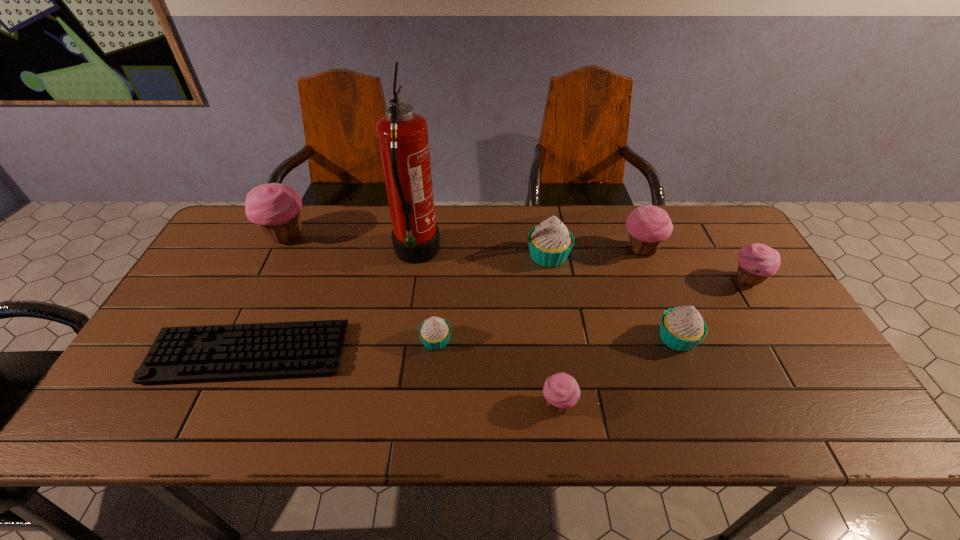
In the image, there is a desktop. At what (x,y) coordinates should I click in order to perform the action: click on vacant space at the far edge. Please return your answer as a coordinate pair (x, y). Image resolution: width=960 pixels, height=540 pixels. Looking at the image, I should click on (528, 210).

I want to click on free space at the near edge of the desktop, so click(x=418, y=430).

You are a GUI agent. You are given a task and a screenshot of the screen. Output one action in this format:
    pyautogui.click(x=<x>, y=<y>)
    Task: Click on the vacant space at the left edge of the desktop
    
    Given the screenshot: What is the action you would take?
    pyautogui.click(x=237, y=265)

Locate an element on the screen. Image resolution: width=960 pixels, height=540 pixels. vacant space at the right edge of the desktop is located at coordinates (779, 311).

Identify the location of vacant space at the far right corner. Image resolution: width=960 pixels, height=540 pixels. (694, 207).

Find the location of a particular element. This screenshot has width=960, height=540. empty space that is in between the leftmost cupcake and the fire extinguisher is located at coordinates (351, 245).

At what (x,y) coordinates should I click in order to perform the action: click on free space between the rightmost white cupcake and the second cupcake from left to right. Please return your answer as a coordinate pair (x, y). Looking at the image, I should click on (557, 339).

At what (x,y) coordinates should I click in order to perform the action: click on free space between the nearest object and the third smallest pink cupcake. Please return your answer as a coordinate pair (x, y). Looking at the image, I should click on (599, 327).

Where is `vacant space in between the rightmost object and the farthest white cupcake`? vacant space in between the rightmost object and the farthest white cupcake is located at coordinates (648, 268).

Where is `vacant point located between the fire extinguisher and the third farthest pink cupcake`? The image size is (960, 540). vacant point located between the fire extinguisher and the third farthest pink cupcake is located at coordinates (582, 267).